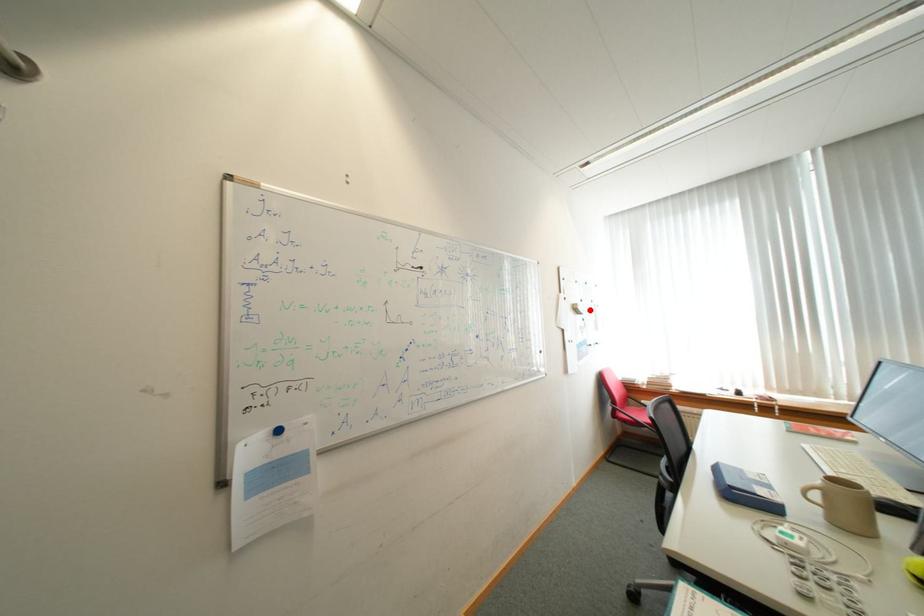
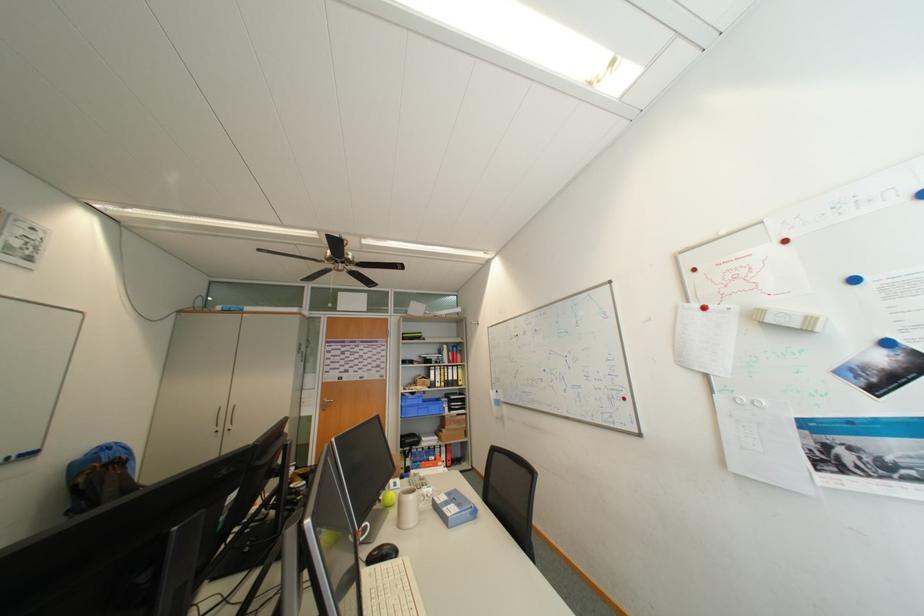
Locate, in the second image, the point that corresponds to the highlighted location in the first image.

(777, 322)